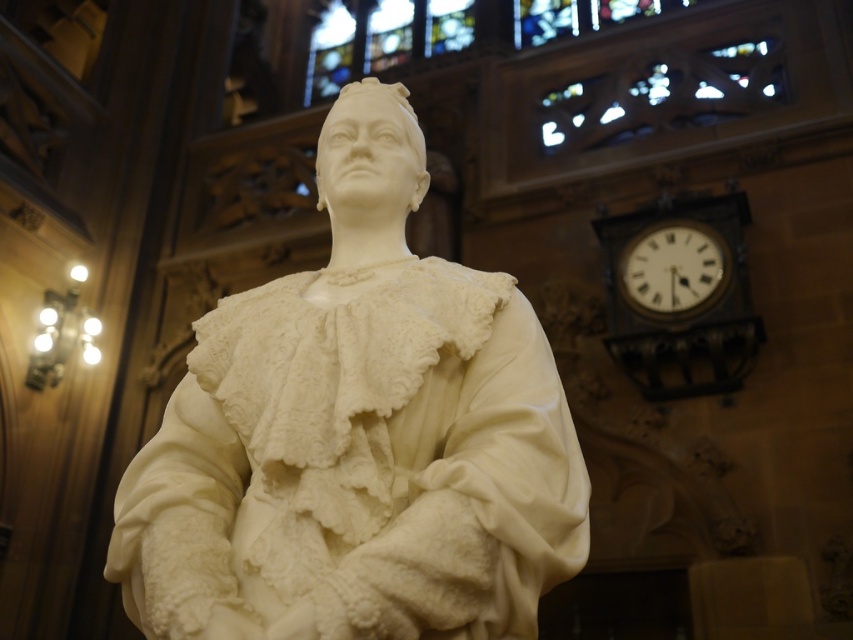
You are an interior designer planning to move the white marble statue at center and the white wooden clock at upper right closer to the entrance. Which object should you move first to ensure they are aligned horizontally with the entrance?

You should move the white marble statue at center first because it is currently to the left of the white wooden clock at upper right, so moving it towards the entrance first will help align them horizontally.

You are an interior designer planning to place a new decorative item in the room. The item is 1.2 meters wide. You see the white marble statue at center and the dark brown wooden clock at upper right. Which object can the new item fit next to without exceeding its width?

The new item can fit next to the dark brown wooden clock at upper right because the white marble statue at center is wider than the dark brown wooden clock at upper right, so the clock has more space available.

You are an interior designer assessing the placement of clocks in a historic hall. You see the dark brown wooden clock at upper right and the white wooden clock at upper right. Which clock is taller?

The dark brown wooden clock at upper right is taller than the white wooden clock at upper right according to the description provided.